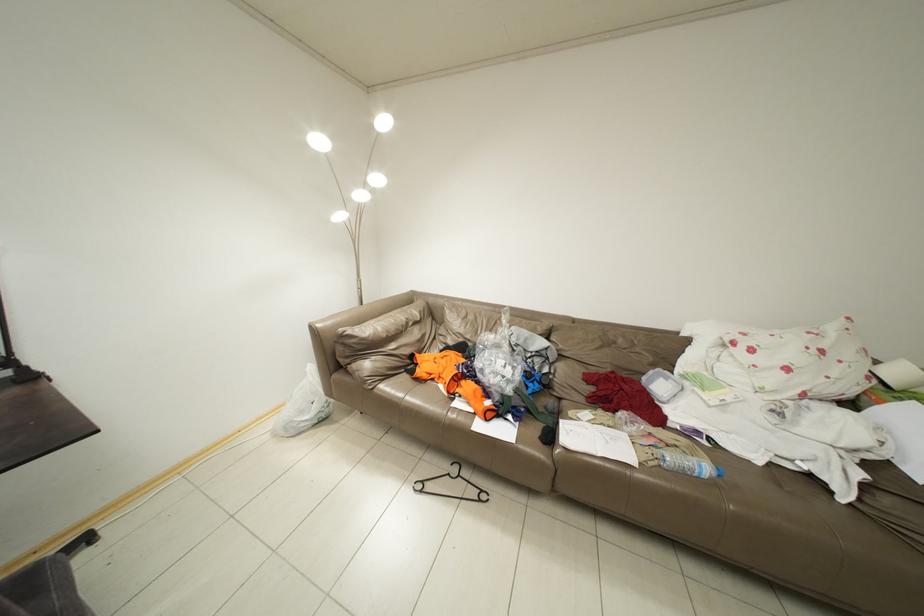
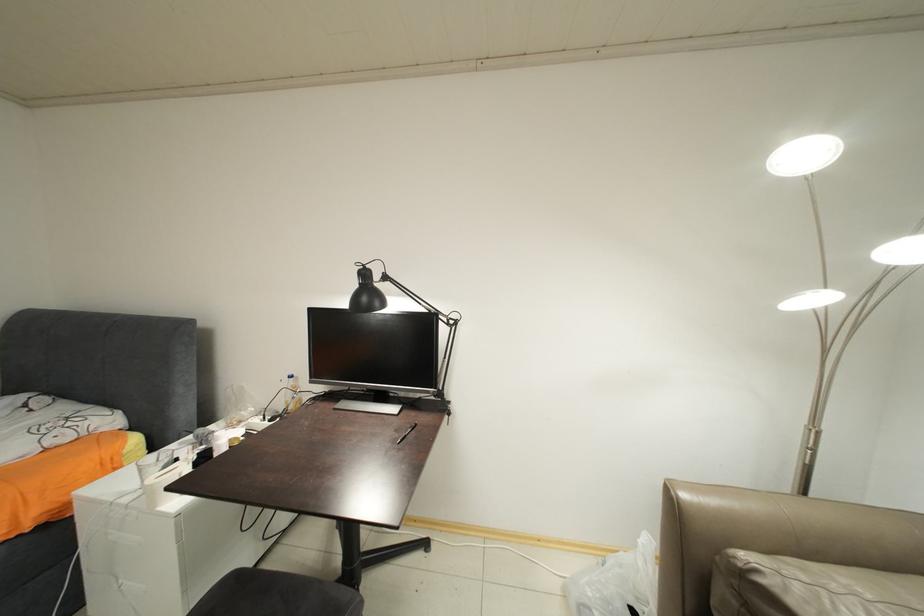
Question: The camera is either moving clockwise (left) or counter-clockwise (right) around the object. The first image is from the beginning of the video and the second image is from the end. Is the camera moving left or right when shooting the video?

Choices:
 (A) Left
 (B) Right

Answer: (B)